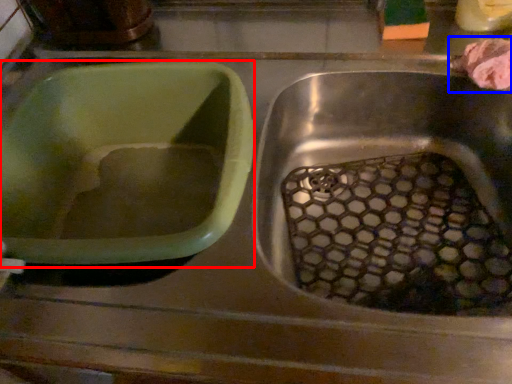
Question: Which object appears closest to the camera in this image, basin (highlighted by a red box) or food (highlighted by a blue box)?

Choices:
 (A) basin
 (B) food

Answer: (A)